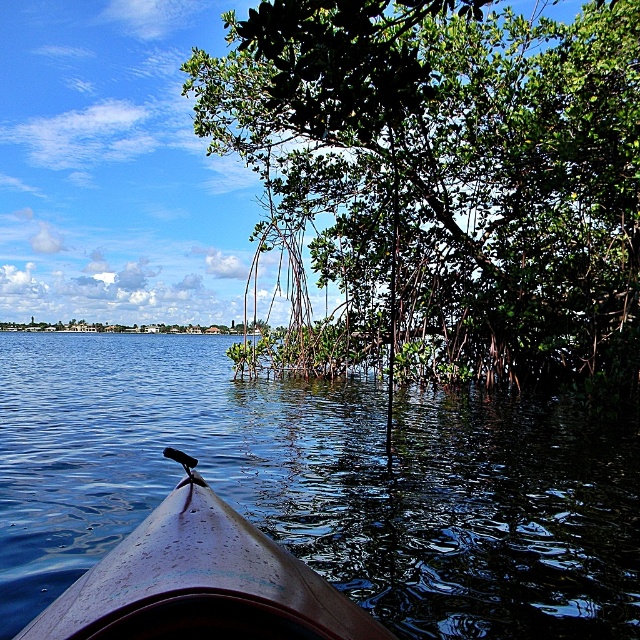
Question: Which point is closer to the camera taking this photo?

Choices:
 (A) (556, 97)
 (B) (324, 630)
 (C) (598, 440)

Answer: (B)

Question: Estimate the real-world distances between objects in this image. Which object is closer to the blue glossy water at center?

Choices:
 (A) green leafy tree at upper right
 (B) brown matte kayak at lower left

Answer: (A)

Question: Observing the image, what is the correct spatial positioning of green leafy tree at upper right in reference to blue glossy water at center?

Choices:
 (A) left
 (B) right

Answer: (B)

Question: Is green leafy tree at upper right to the left of blue glossy water at center from the viewer's perspective?

Choices:
 (A) yes
 (B) no

Answer: (B)

Question: Which of the following is the farthest from the observer?

Choices:
 (A) green leafy tree at upper right
 (B) blue glossy water at center

Answer: (A)

Question: Does green leafy tree at upper right have a smaller size compared to blue glossy water at center?

Choices:
 (A) no
 (B) yes

Answer: (B)